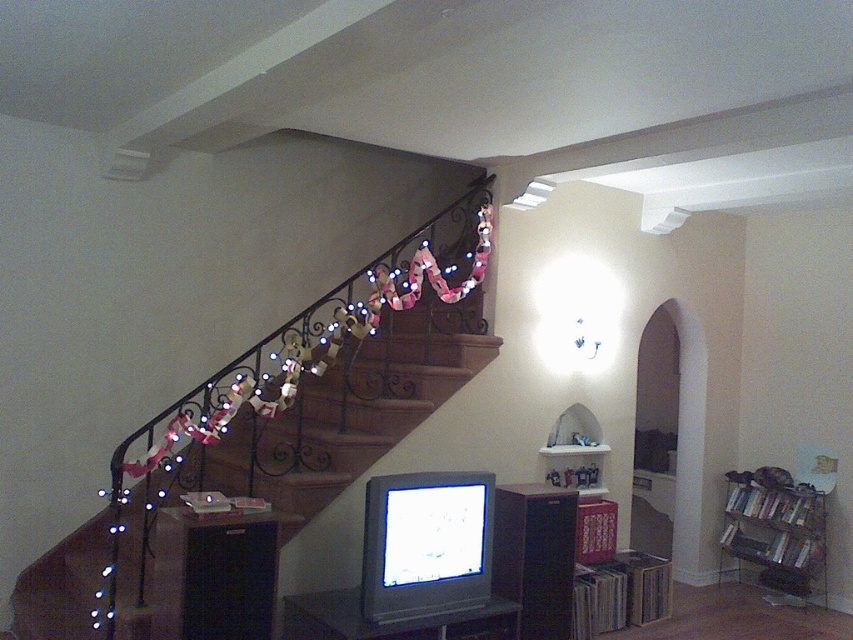
Can you confirm if wooden stairs at left is positioned below metallic silver bookshelf at lower right?

Actually, wooden stairs at left is above metallic silver bookshelf at lower right.

Is point (27, 632) positioned behind point (804, 563)?

No, it is in front of (804, 563).

Where is `wooden stairs at left`? wooden stairs at left is located at coordinates click(352, 410).